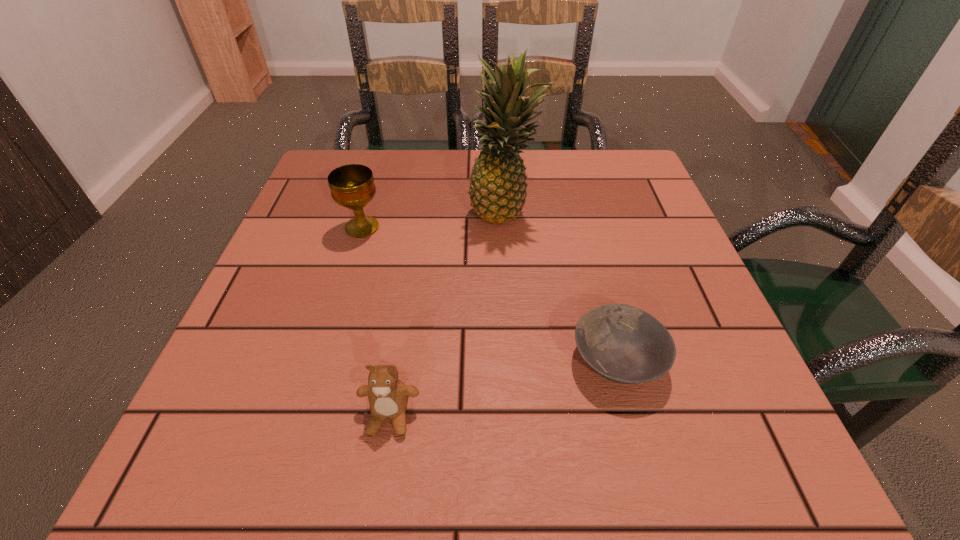
At what (x,y) coordinates should I click in order to perform the action: click on free spot between the third object from right to left and the tallest object. Please return your answer as a coordinate pair (x, y). The height and width of the screenshot is (540, 960). Looking at the image, I should click on (447, 314).

You are a GUI agent. You are given a task and a screenshot of the screen. Output one action in this format:
    pyautogui.click(x=<x>, y=<y>)
    Task: Click on the free point between the teddy bear and the pineapple
    
    Given the screenshot: What is the action you would take?
    pyautogui.click(x=447, y=314)

Where is `free area in between the leftmost object and the bowl`? The image size is (960, 540). free area in between the leftmost object and the bowl is located at coordinates (490, 294).

Select which object is the second closest to the tallest object. Please provide its 2D coordinates. Your answer should be formatted as a tuple, i.e. [(x, y)], where the tuple contains the x and y coordinates of a point satisfying the conditions above.

[(622, 343)]

Choose which object is the nearest neighbor to the second object from right to left. Please provide its 2D coordinates. Your answer should be formatted as a tuple, i.e. [(x, y)], where the tuple contains the x and y coordinates of a point satisfying the conditions above.

[(352, 186)]

At what (x,y) coordinates should I click in order to perform the action: click on vacant space that satisfies the following two spatial constraints: 1. on the back side of the chalice; 2. on the right side of the tallest object. Please return your answer as a coordinate pair (x, y). Looking at the image, I should click on (367, 211).